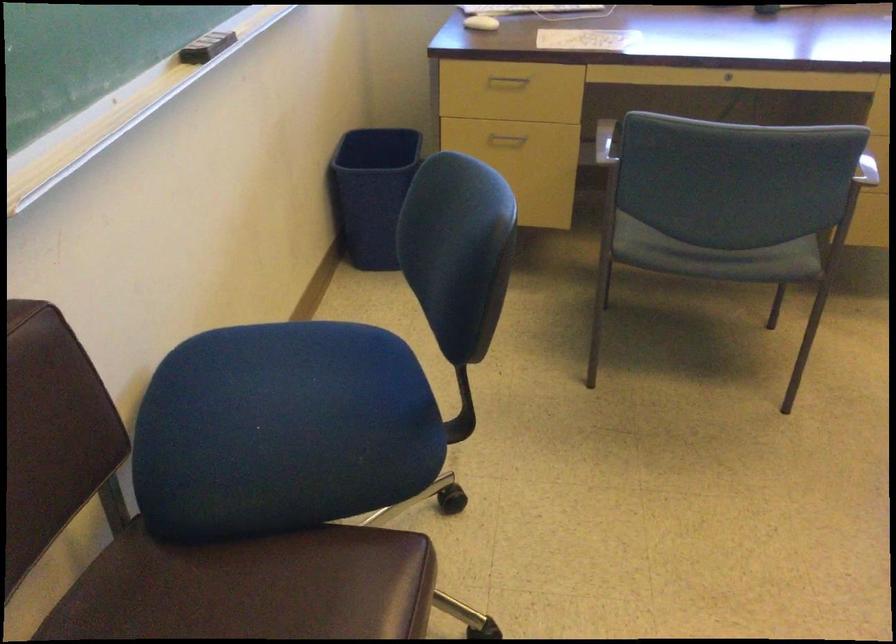
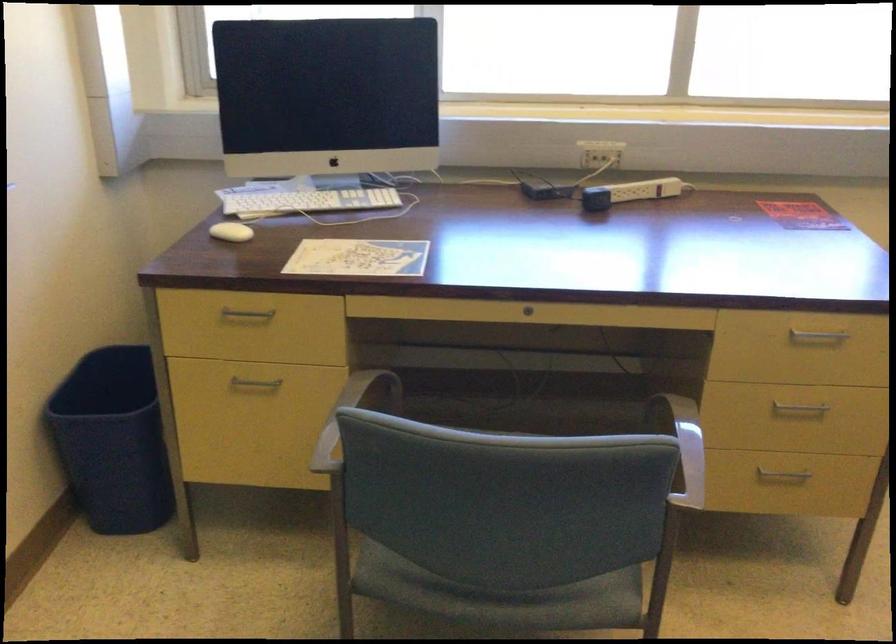
In the second image, find the point that corresponds to [633,114] in the first image.

(350, 415)